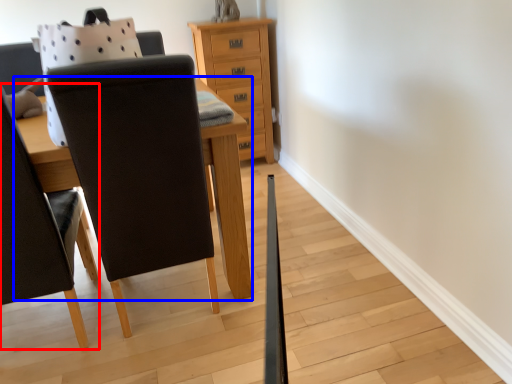
Question: Which object is closer to the camera taking this photo, chair (highlighted by a red box) or table (highlighted by a blue box)?

Choices:
 (A) chair
 (B) table

Answer: (A)